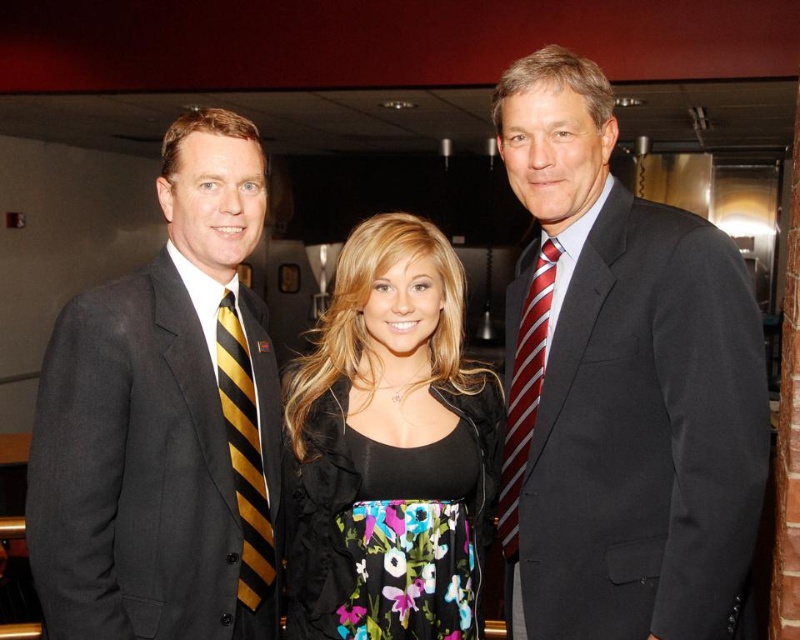
Question: Which object is farther from the camera taking this photo?

Choices:
 (A) black suit at left
 (B) floral dress at center
 (C) matte black suit at center
 (D) red striped tie at right

Answer: (B)

Question: Is matte black suit at center behind yellow striped tie at left?

Choices:
 (A) yes
 (B) no

Answer: (B)

Question: Among these points, which one is nearest to the camera?

Choices:
 (A) (234, 228)
 (B) (238, 582)
 (C) (684, 413)
 (D) (398, 579)

Answer: (C)

Question: Is matte black suit at center smaller than floral dress at center?

Choices:
 (A) no
 (B) yes

Answer: (A)

Question: Is floral dress at center wider than red striped tie at right?

Choices:
 (A) yes
 (B) no

Answer: (A)

Question: Which object is closer to the camera taking this photo?

Choices:
 (A) matte black suit at center
 (B) floral dress at center
 (C) black suit at left
 (D) red striped tie at right

Answer: (A)